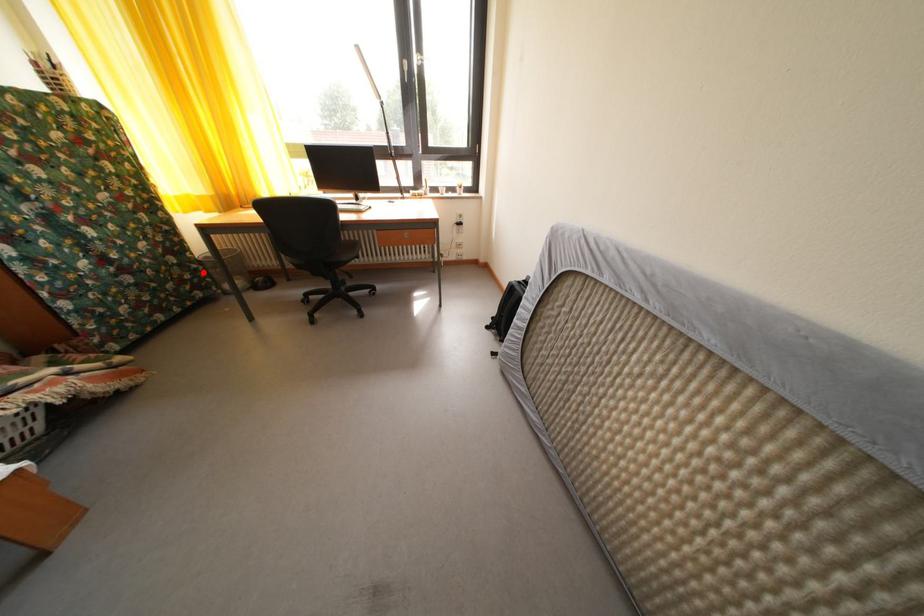
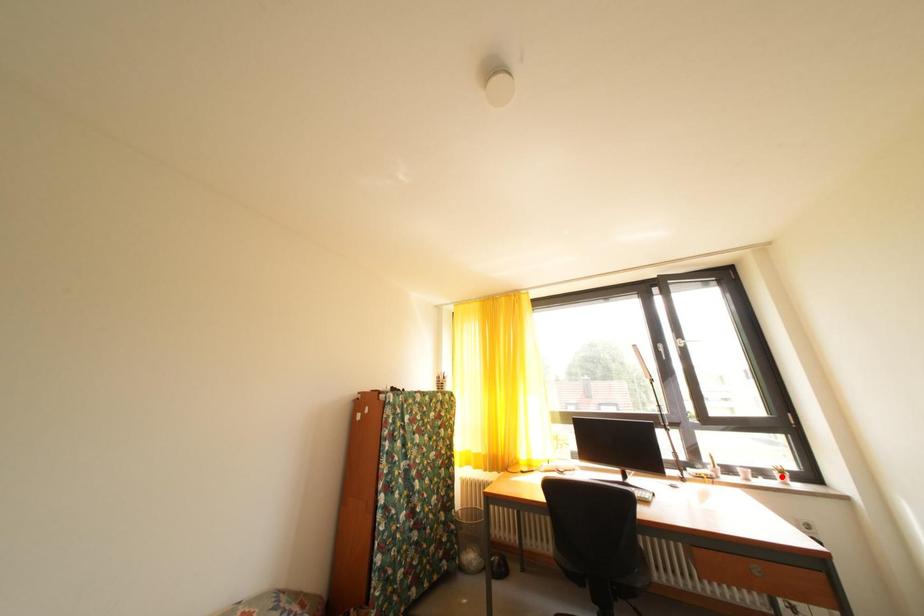
I am providing you with two images of the same scene from different viewpoints. A red point is marked on the first image and another point is marked on the second image. Are the points marked in image1 and image2 representing the same 3D position?

No